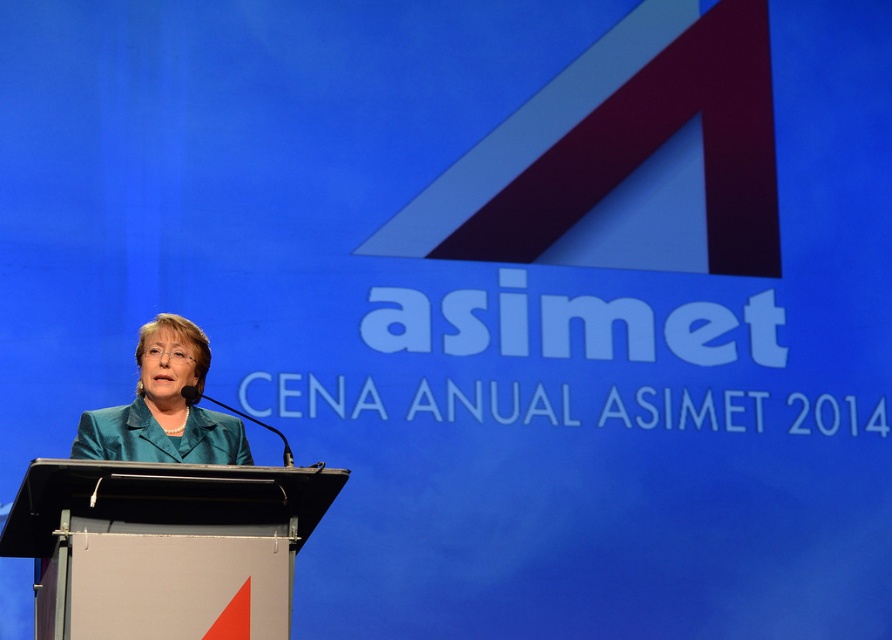
Identify the location of metallic gray podium at center. This screenshot has height=640, width=892. (160, 516).

Is point (81, 596) in front of point (244, 440)?

That is True.

Locate an element on the screen. This screenshot has height=640, width=892. metallic gray podium at center is located at coordinates (160, 516).